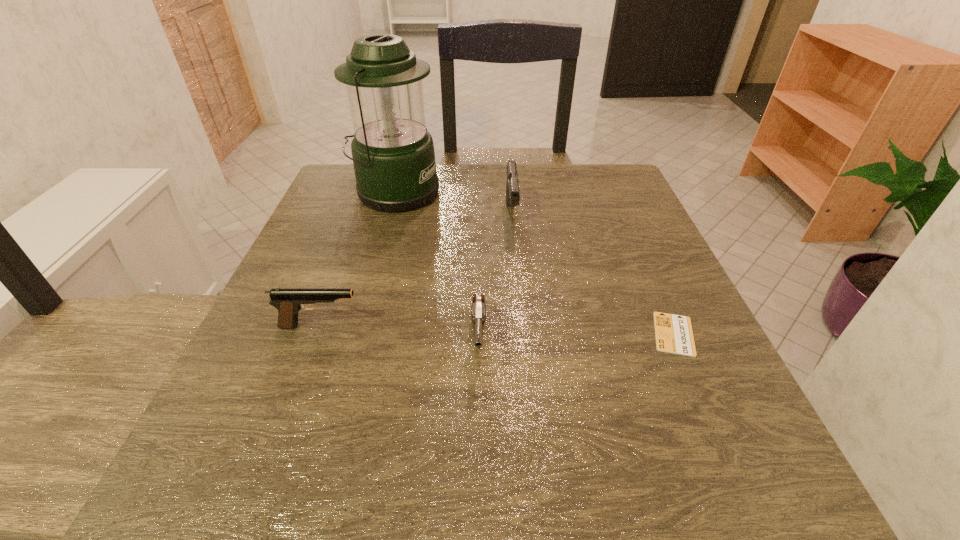
Image resolution: width=960 pixels, height=540 pixels. What are the coordinates of `free location that satisfies the following two spatial constraints: 1. at the muzzle of the identity card; 2. on the left side of the leftmost pistol` in the screenshot? It's located at click(x=317, y=334).

Identify the location of blank area in the image that satisfies the following two spatial constraints: 1. aim along the barrel of the fourth object from left to right; 2. at the muzzle of the leftmost pistol. This screenshot has height=540, width=960. (523, 326).

Where is `free region that satisfies the following two spatial constraints: 1. aim along the barrel of the fourth object from left to right; 2. at the muzzle of the leftmost pistol`? The height and width of the screenshot is (540, 960). free region that satisfies the following two spatial constraints: 1. aim along the barrel of the fourth object from left to right; 2. at the muzzle of the leftmost pistol is located at coordinates (523, 326).